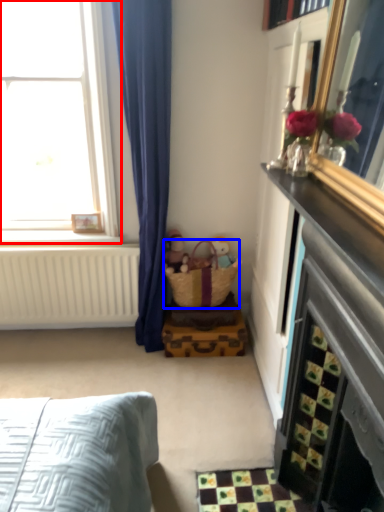
Question: Among these objects, which one is farthest to the camera, window (highlighted by a red box) or basket (highlighted by a blue box)?

Choices:
 (A) window
 (B) basket

Answer: (B)